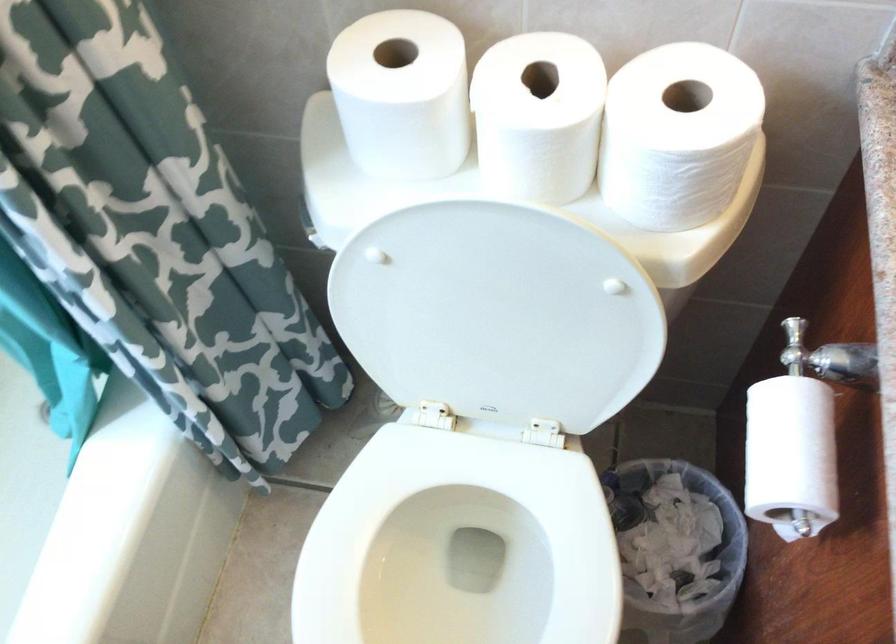
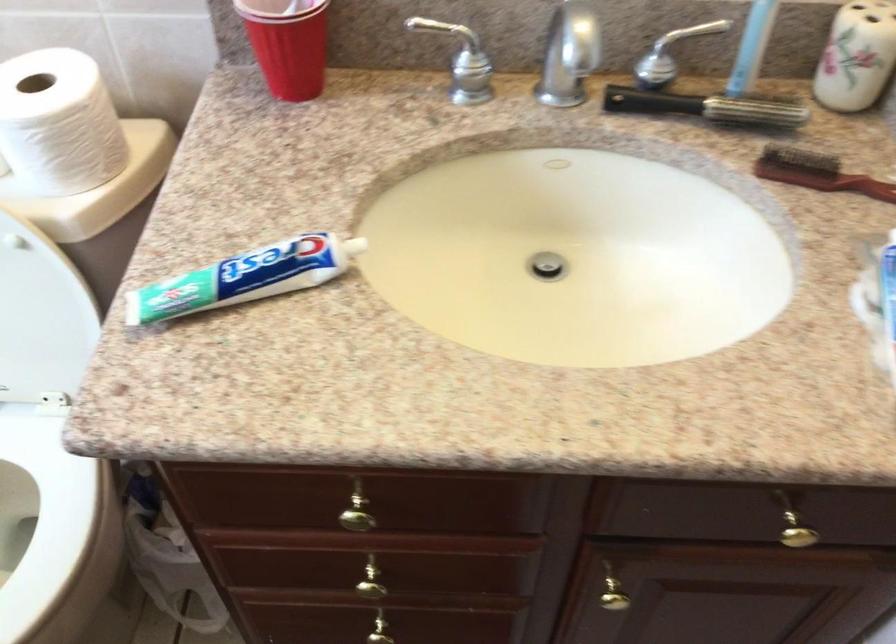
The point at (727, 160) is marked in the first image. Where is the corresponding point in the second image?

(58, 122)